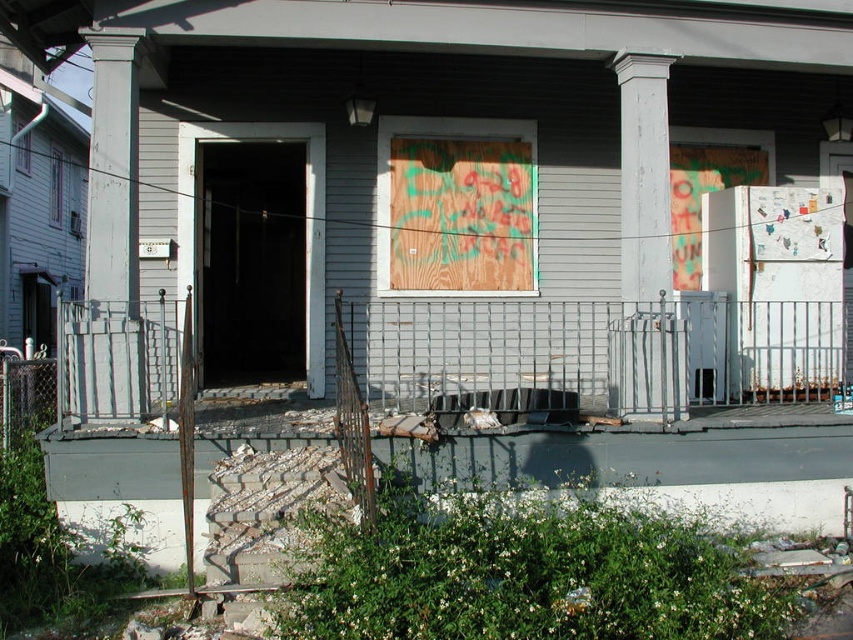
You are a contractor assessing the structural integrity of the dilapidated house. You notice two columns supporting the porch roof. The smooth gray column at left and the white painted wood column at center. Which column should you prioritize inspecting first based on their size?

The smooth gray column at left should be prioritized for inspection first because it is larger in size than the white painted wood column at center, which may indicate it bears more weight and requires immediate attention.

You are standing in front of the dilapidated house and notice two points marked on the image. The first point is at coordinates point (x=137, y=160) and the second is at point (x=646, y=224). Which point is closer to you?

Point (x=137, y=160) is closer to the camera than point (x=646, y=224).

You are standing at point (111, 243) in the dilapidated house scene. What object is located exactly at your current position?

The smooth gray column at left is located exactly at point (111, 243).